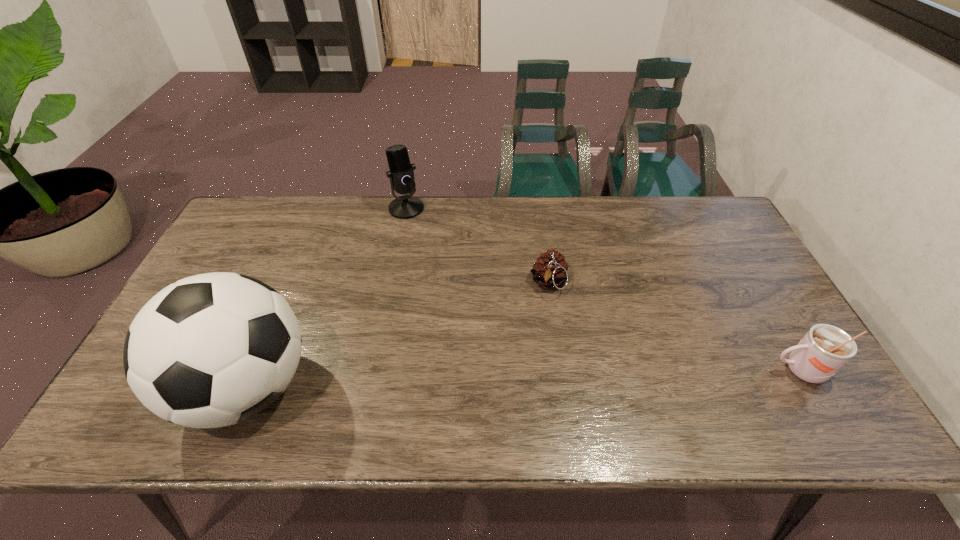
This screenshot has height=540, width=960. I want to click on the leftmost object, so click(x=211, y=350).

Where is `soccer ball`? soccer ball is located at coordinates (211, 350).

This screenshot has height=540, width=960. Identify the location of cup. (824, 349).

Where is `the third tallest object`? This screenshot has width=960, height=540. the third tallest object is located at coordinates (824, 349).

Where is `the farthest object`? The image size is (960, 540). the farthest object is located at coordinates (401, 174).

Find the location of `microphone`. microphone is located at coordinates (401, 174).

Image resolution: width=960 pixels, height=540 pixels. Find the location of `the second object from right to left`. the second object from right to left is located at coordinates (550, 271).

This screenshot has width=960, height=540. Find the location of `the shortest object`. the shortest object is located at coordinates (550, 271).

The width and height of the screenshot is (960, 540). I want to click on vacant region located 0.070m on the left of the tallest object, so click(150, 387).

Locate an element on the screen. Image resolution: width=960 pixels, height=540 pixels. vacant space located 0.190m on the side with the handle of the cup is located at coordinates (690, 370).